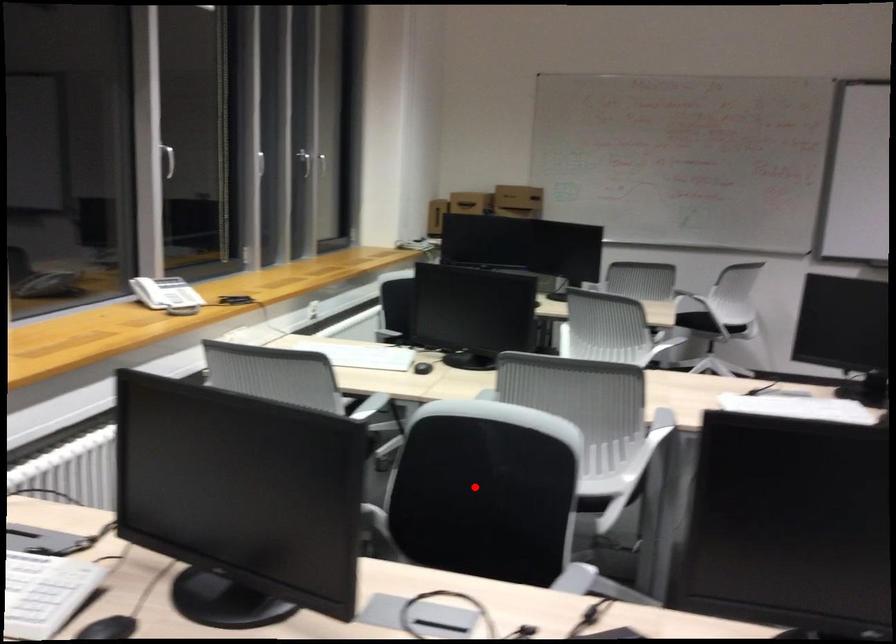
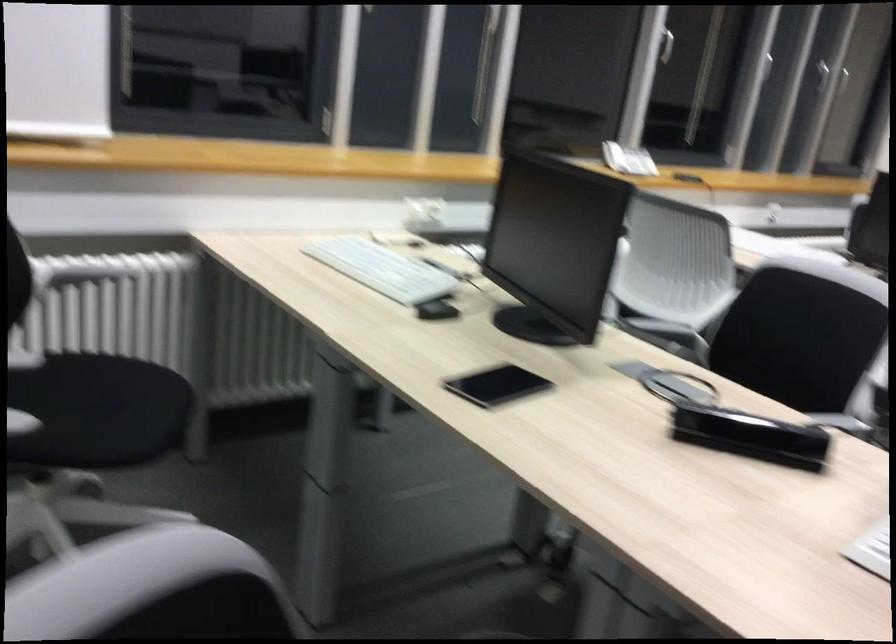
Locate, in the second image, the point that corresponds to the highlighted location in the first image.

(798, 337)